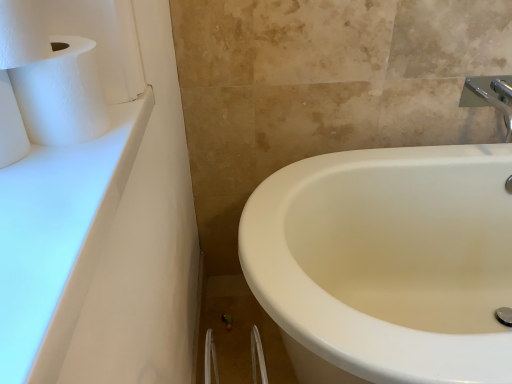
Question: From a real-world perspective, is white textured toilet paper at upper left, the second toilet paper from the bottom, on top of white matte toilet paper at left, the 1th toilet paper when ordered from bottom to top?

Choices:
 (A) no
 (B) yes

Answer: (B)

Question: Considering the relative sizes of white textured toilet paper at upper left, the second toilet paper from the bottom, and white matte toilet paper at left, which is the 2th toilet paper in top-to-bottom order, in the image provided, is white textured toilet paper at upper left, the second toilet paper from the bottom, shorter than white matte toilet paper at left, which is the 2th toilet paper in top-to-bottom order,?

Choices:
 (A) yes
 (B) no

Answer: (A)

Question: Is white textured toilet paper at upper left, the 1th toilet paper from the top, positioned far away from white matte toilet paper at left, which is the 2th toilet paper in top-to-bottom order?

Choices:
 (A) yes
 (B) no

Answer: (B)

Question: From the image's perspective, is white textured toilet paper at upper left, the 1th toilet paper from the top, on top of white matte toilet paper at left, which is the 2th toilet paper in top-to-bottom order?

Choices:
 (A) yes
 (B) no

Answer: (A)

Question: Is the position of white textured toilet paper at upper left, the second toilet paper from the bottom, more distant than that of white matte toilet paper at left, which is the 2th toilet paper in top-to-bottom order?

Choices:
 (A) yes
 (B) no

Answer: (B)

Question: Is silver metallic faucet at upper right taller or shorter than white glossy countertop at upper left?

Choices:
 (A) short
 (B) tall

Answer: (B)

Question: From the image's perspective, relative to white glossy countertop at upper left, is silver metallic faucet at upper right above or below?

Choices:
 (A) above
 (B) below

Answer: (A)

Question: Is silver metallic faucet at upper right wider or thinner than white glossy countertop at upper left?

Choices:
 (A) thin
 (B) wide

Answer: (B)

Question: Relative to white glossy countertop at upper left, is silver metallic faucet at upper right in front or behind?

Choices:
 (A) front
 (B) behind

Answer: (B)

Question: Looking at the image, does white matte paper towel at upper left seem bigger or smaller compared to white matte toilet paper at left, which is the 2th toilet paper in top-to-bottom order?

Choices:
 (A) big
 (B) small

Answer: (A)

Question: Is point (30, 112) closer or farther from the camera than point (26, 145)?

Choices:
 (A) farther
 (B) closer

Answer: (B)

Question: From a real-world perspective, is white matte paper towel at upper left physically located above or below white matte toilet paper at left, the 1th toilet paper when ordered from bottom to top?

Choices:
 (A) above
 (B) below

Answer: (B)

Question: From the image's perspective, is white matte paper towel at upper left above or below white matte toilet paper at left, the 1th toilet paper when ordered from bottom to top?

Choices:
 (A) below
 (B) above

Answer: (B)

Question: Is white matte toilet paper at left, which is the 2th toilet paper in top-to-bottom order, in front of or behind white matte paper towel at upper left in the image?

Choices:
 (A) behind
 (B) front

Answer: (B)

Question: From a real-world perspective, is white matte toilet paper at left, the 1th toilet paper when ordered from bottom to top, physically located above or below white matte paper towel at upper left?

Choices:
 (A) above
 (B) below

Answer: (A)